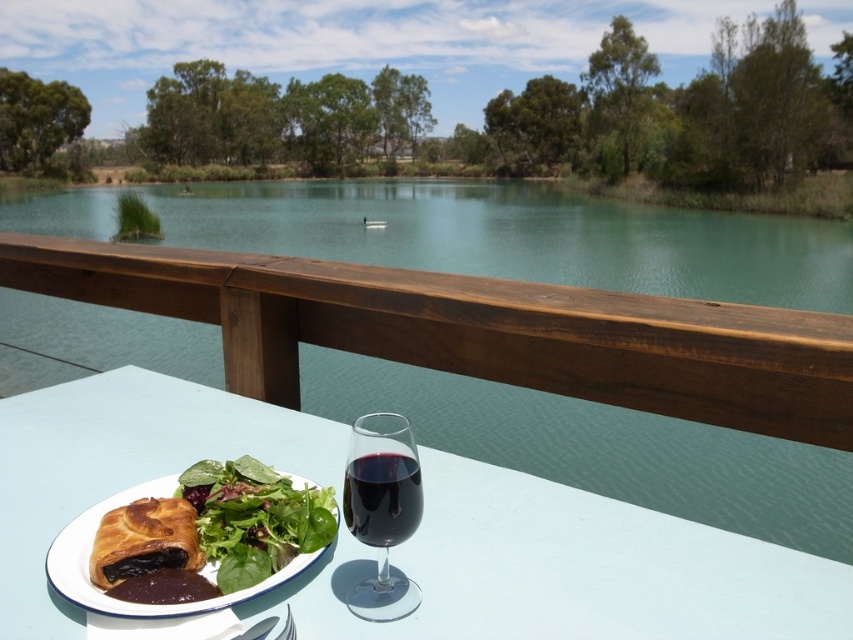
Who is higher up, clear water at table center or dark red glass at center?

Positioned higher is dark red glass at center.

Who is shorter, clear water at table center or dark red glass at center?

dark red glass at center is shorter.

Is point (32, 376) less distant than point (397, 509)?

No, (32, 376) is behind (397, 509).

This screenshot has height=640, width=853. In order to click on clear water at table center in this screenshot , I will do `click(521, 236)`.

Who is lower down, white glossy table at lower center or green leafy salad at center?

white glossy table at lower center

Between point (42, 612) and point (258, 561), which one is positioned in front?

Point (42, 612) is in front.

Locate an element on the screen. This screenshot has width=853, height=640. white glossy table at lower center is located at coordinates (567, 570).

This screenshot has width=853, height=640. I want to click on white glossy table at lower center, so click(567, 570).

How distant is clear water at table center from green leafy salad at center?

clear water at table center is 29.55 inches away from green leafy salad at center.

Is point (532, 241) positioned before point (310, 529)?

No, (532, 241) is further to viewer.

Identify the location of clear water at table center. Image resolution: width=853 pixels, height=640 pixels. (521, 236).